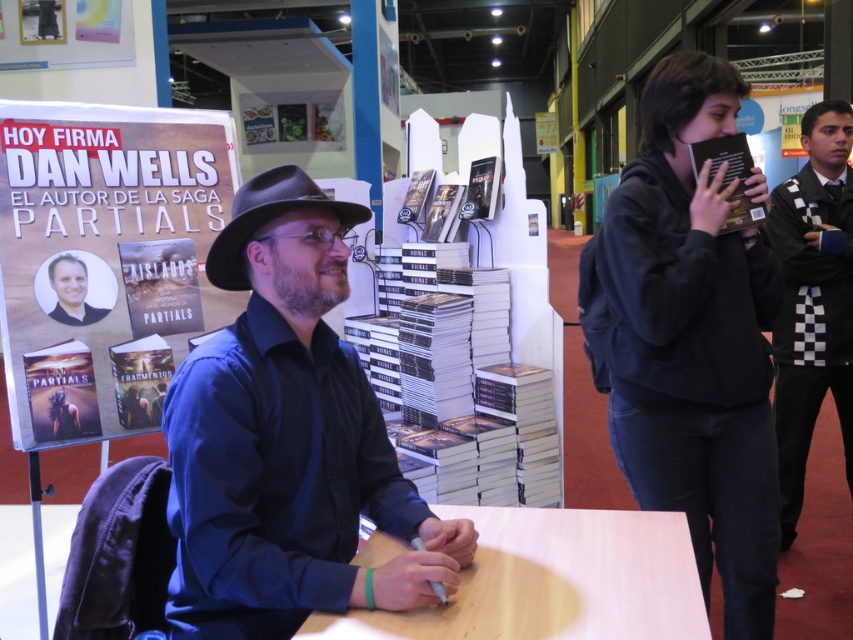
Based on the photo, you are organizing a book signing event and need to place a new tablecloth on the light brown wood table at center. The tablecloth you have is the same size as the white paper poster at upper left. Will the tablecloth fit the table?

The light brown wood table at center is narrower than the white paper poster at upper left, so the tablecloth, which is the same size as the poster, will be wider than the table. Therefore, the tablecloth will fit the table as it is wider than the table itself.